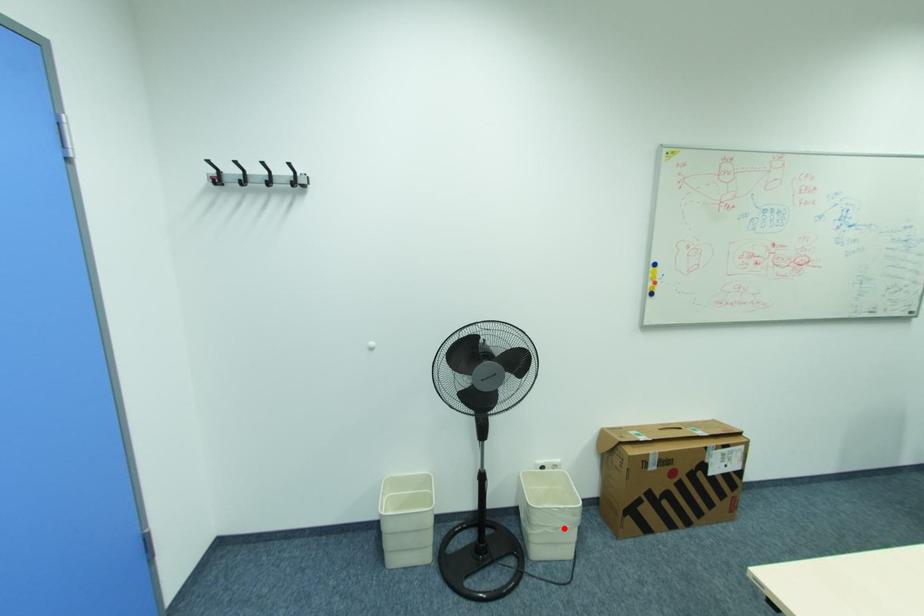
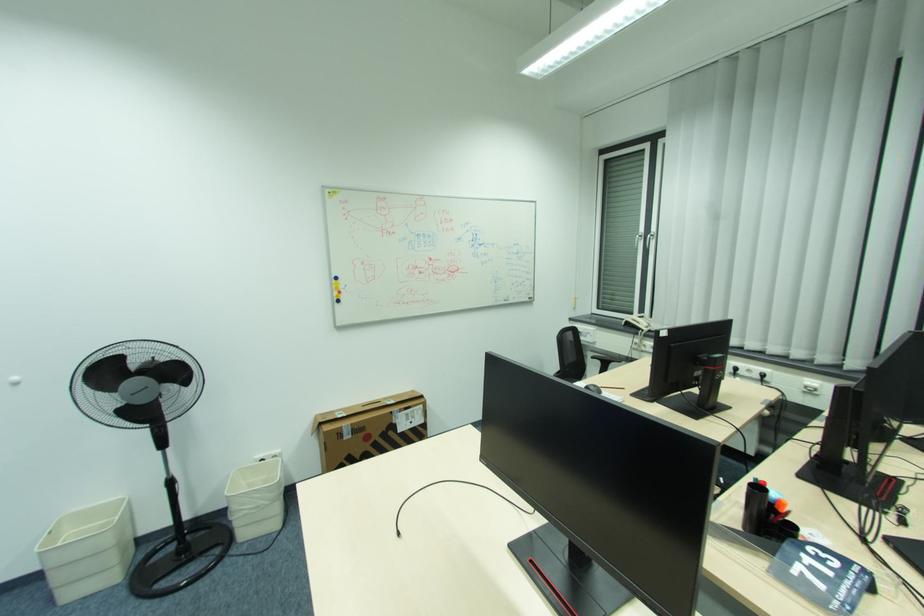
Question: I am providing you with two images of the same scene from different viewpoints. In image1, a red point is highlighted. Considering the same 3D point in image2, which of the following is correct?

Choices:
 (A) It is closer
 (B) It is farther

Answer: (A)